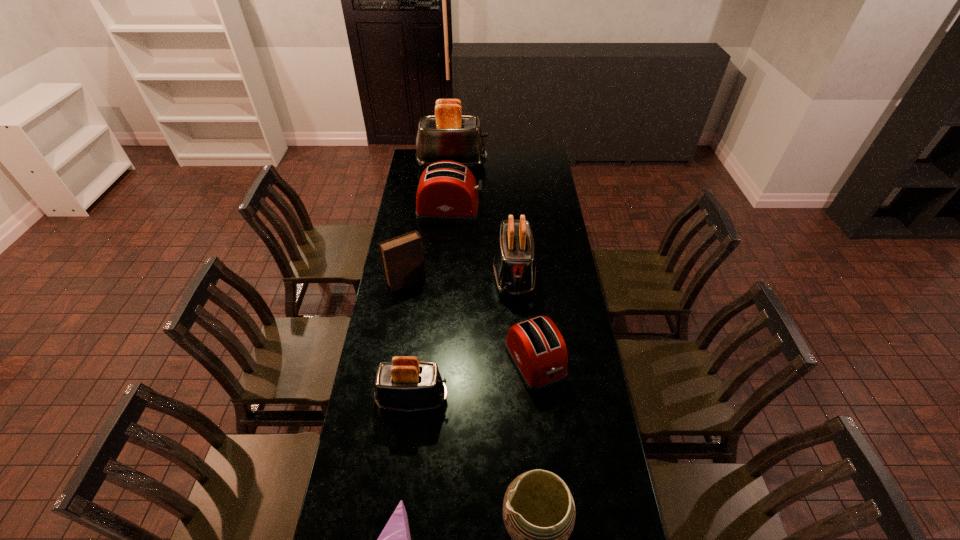
Image resolution: width=960 pixels, height=540 pixels. I want to click on the farthest toaster, so click(448, 135).

The image size is (960, 540). What are the coordinates of `the farthest object` in the screenshot? It's located at (448, 135).

The width and height of the screenshot is (960, 540). What are the coordinates of `the third farthest toaster` in the screenshot? It's located at (514, 266).

Find the location of a particular element. This screenshot has width=960, height=540. the seventh shortest object is located at coordinates (514, 266).

The image size is (960, 540). What are the coordinates of `the fourth nearest toaster` in the screenshot? It's located at (447, 192).

Where is `the left red toaster`? the left red toaster is located at coordinates (447, 192).

Where is `Bible`? The height and width of the screenshot is (540, 960). Bible is located at coordinates (402, 258).

Find the location of `the smallest gray toaster`. the smallest gray toaster is located at coordinates (404, 384).

Find the location of a particular element. This screenshot has width=960, height=540. the nearer red toaster is located at coordinates (536, 347).

The width and height of the screenshot is (960, 540). I want to click on the smaller red toaster, so click(x=536, y=347).